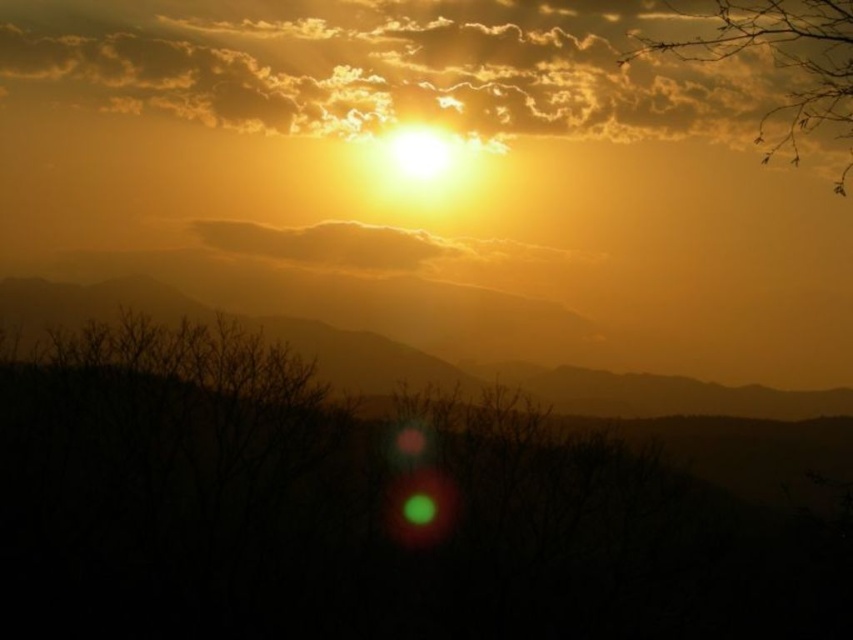
Question: Does silhouette bark tree at lower left appear under silhouetted mountain at center?

Choices:
 (A) no
 (B) yes

Answer: (B)

Question: Which point is closer to the camera taking this photo?

Choices:
 (A) (64, 292)
 (B) (346, 516)

Answer: (B)

Question: Does silhouette bark tree at lower left appear on the left side of silvery branches at upper right?

Choices:
 (A) no
 (B) yes

Answer: (B)

Question: Among these objects, which one is nearest to the camera?

Choices:
 (A) silhouette bark tree at lower left
 (B) silhouetted mountain at center

Answer: (A)

Question: Does silhouette bark tree at lower left appear over silhouetted mountain at center?

Choices:
 (A) yes
 (B) no

Answer: (B)

Question: Which object is closer to the camera taking this photo?

Choices:
 (A) silhouetted mountain at center
 (B) silvery branches at upper right

Answer: (B)